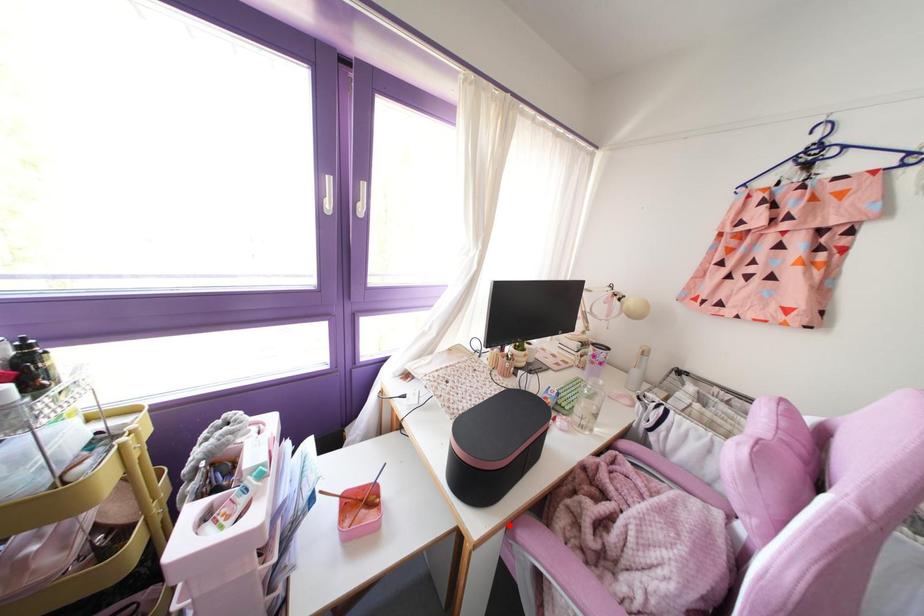
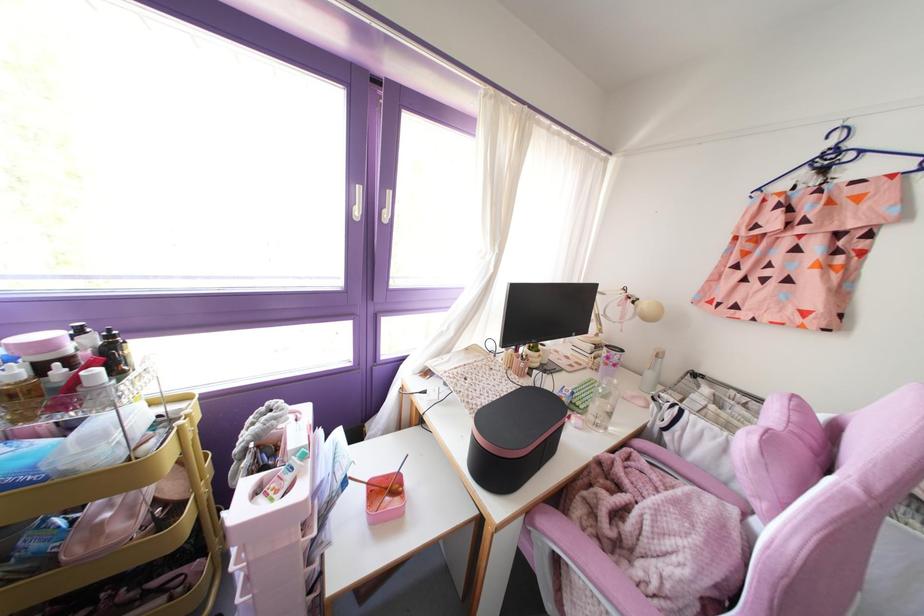
Where in the second image is the point corresponding to the highlighted location from the first image?

(528, 513)